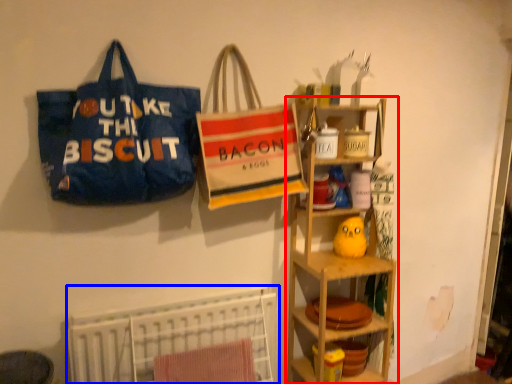
Question: Which object appears closest to the camera in this image, shelf (highlighted by a red box) or bed (highlighted by a blue box)?

Choices:
 (A) shelf
 (B) bed

Answer: (B)